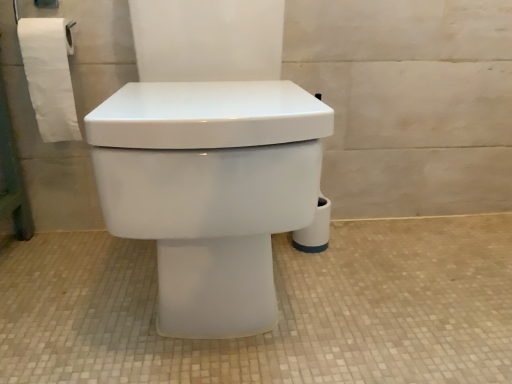
Question: Is white paper at left bigger or smaller than white glossy toilet at center?

Choices:
 (A) big
 (B) small

Answer: (B)

Question: Visually, is white paper at left positioned to the left or to the right of white glossy toilet at center?

Choices:
 (A) right
 (B) left

Answer: (B)

Question: Looking at their shapes, would you say white paper at left is wider or thinner than white glossy toilet at center?

Choices:
 (A) thin
 (B) wide

Answer: (A)

Question: Considering the positions of white glossy toilet at center and white paper at left in the image, is white glossy toilet at center taller or shorter than white paper at left?

Choices:
 (A) tall
 (B) short

Answer: (A)

Question: From a real-world perspective, is white glossy toilet at center above or below white paper at left?

Choices:
 (A) below
 (B) above

Answer: (A)

Question: Based on their sizes in the image, would you say white glossy toilet at center is bigger or smaller than white paper at left?

Choices:
 (A) small
 (B) big

Answer: (B)

Question: Is white glossy toilet at center wider or thinner than white paper at left?

Choices:
 (A) thin
 (B) wide

Answer: (B)